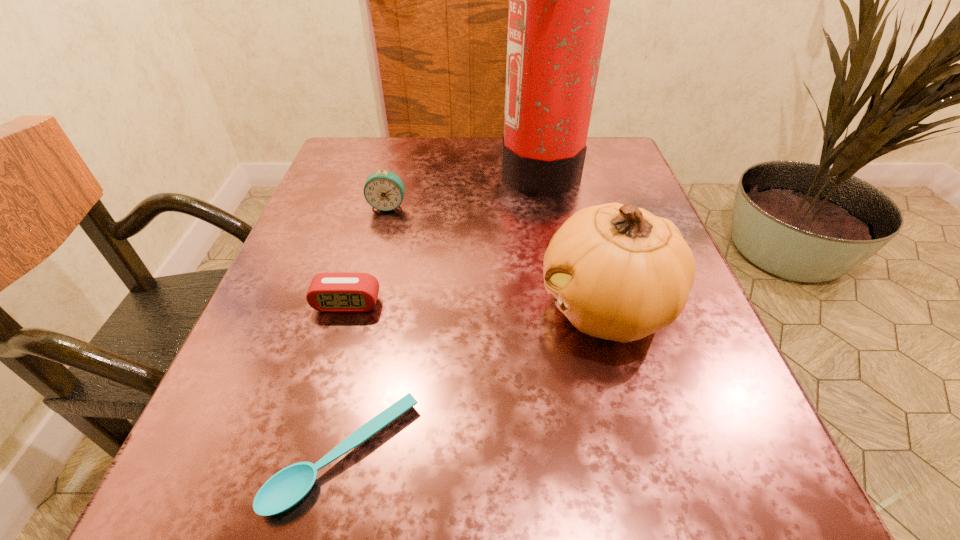
At what (x,y) coordinates should I click in order to perform the action: click on unoccupied position between the tallest object and the farther alarm clock. Please return your answer as a coordinate pair (x, y). The width and height of the screenshot is (960, 540). Looking at the image, I should click on (464, 187).

Where is `empty space that is in between the second tallest object and the shorter alarm clock`? empty space that is in between the second tallest object and the shorter alarm clock is located at coordinates (476, 306).

You are a GUI agent. You are given a task and a screenshot of the screen. Output one action in this format:
    pyautogui.click(x=<x>, y=<y>)
    Task: Click on the free spot between the nearer alarm clock and the second tallest object
    The width and height of the screenshot is (960, 540).
    Given the screenshot: What is the action you would take?
    pyautogui.click(x=476, y=306)

Locate an element on the screen. The height and width of the screenshot is (540, 960). blank region between the nearest object and the fire extinguisher is located at coordinates (443, 312).

Where is `vacant region between the third tallest object and the pumpkin`? The width and height of the screenshot is (960, 540). vacant region between the third tallest object and the pumpkin is located at coordinates (497, 256).

The image size is (960, 540). What are the coordinates of `free spot between the nearest object and the nearer alarm clock` in the screenshot? It's located at pos(347,379).

At what (x,y) coordinates should I click in order to perform the action: click on free space between the spoon and the nearer alarm clock. Please return your answer as a coordinate pair (x, y). This screenshot has width=960, height=540. Looking at the image, I should click on (347, 379).

At what (x,y) coordinates should I click in order to perform the action: click on vacant space that is in between the shorter alarm clock and the third shortest object. Please return your answer as a coordinate pair (x, y). The width and height of the screenshot is (960, 540). Looking at the image, I should click on (368, 255).

Choose which object is the fourth nearest neighbor to the spoon. Please provide its 2D coordinates. Your answer should be formatted as a tuple, i.e. [(x, y)], where the tuple contains the x and y coordinates of a point satisfying the conditions above.

[(559, 0)]

Identify which object is located as the second nearest to the second shortest object. Please provide its 2D coordinates. Your answer should be formatted as a tuple, i.e. [(x, y)], where the tuple contains the x and y coordinates of a point satisfying the conditions above.

[(384, 190)]